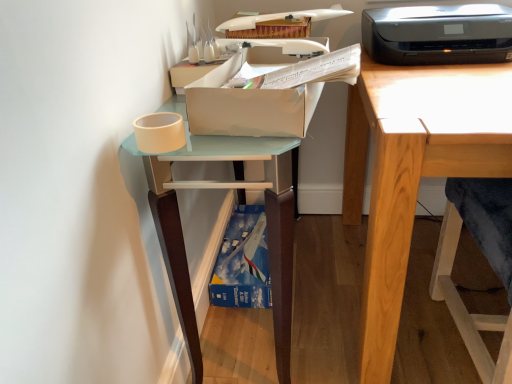
Find the location of a particular element. This screenshot has height=384, width=512. cardboard box at upper center is located at coordinates (254, 95).

What is the approximate width of matte white shelf at left?

matte white shelf at left is 35.12 centimeters wide.

The image size is (512, 384). I want to click on wooden folding chair at right, so click(487, 259).

I want to click on cardboard box at upper center, so click(254, 95).

From a real-world perspective, does black plastic printer at upper right sit lower than cardboard box at upper center?

Actually, black plastic printer at upper right is physically above cardboard box at upper center in the real world.

Is black plastic printer at upper right further to the viewer compared to cardboard box at upper center?

That is True.

Which is nearer, (504, 60) or (231, 90)?

The point (231, 90) is more forward.

Is matte white shelf at left facing towards cardboard box at upper center?

No, matte white shelf at left is not oriented towards cardboard box at upper center.

Looking at this image, is matte white shelf at left far from cardboard box at upper center?

matte white shelf at left is near cardboard box at upper center, not far away.

Which is more to the left, matte white shelf at left or cardboard box at upper center?

Positioned to the left is matte white shelf at left.

Is point (292, 237) positioned before point (311, 110)?

No, (292, 237) is behind (311, 110).

Is wooden folding chair at right beside black plastic printer at upper right?

wooden folding chair at right and black plastic printer at upper right are not in contact.

What's the angular difference between wooden folding chair at right and black plastic printer at upper right's facing directions?

There is a 179-degree angle between the facing directions of wooden folding chair at right and black plastic printer at upper right.

Considering the relative positions of wooden folding chair at right and black plastic printer at upper right in the image provided, is wooden folding chair at right to the right of black plastic printer at upper right from the viewer's perspective?

Yes, wooden folding chair at right is to the right of black plastic printer at upper right.

From a real-world perspective, which is physically below, wooden folding chair at right or black plastic printer at upper right?

wooden folding chair at right, from a real-world perspective.

From the image's perspective, which is above, cardboard box at upper center or wooden desk at right?

cardboard box at upper center, from the image's perspective.

Can we say cardboard box at upper center lies outside wooden desk at right?

That's correct, cardboard box at upper center is outside of wooden desk at right.

Looking at the image, does cardboard box at upper center seem bigger or smaller compared to wooden desk at right?

In the image, cardboard box at upper center appears to be smaller than wooden desk at right.

Can you confirm if cardboard box at upper center is positioned to the left of wooden desk at right?

Yes.

Which object is thinner, wooden folding chair at right or matte white shelf at left?

matte white shelf at left.

Is wooden folding chair at right closer to the viewer compared to matte white shelf at left?

Yes, wooden folding chair at right is closer to the camera.

Where is `printer that is behind the wooden desk at right`? printer that is behind the wooden desk at right is located at coordinates (438, 34).

Considering the sizes of objects black plastic printer at upper right and wooden desk at right in the image provided, who is shorter, black plastic printer at upper right or wooden desk at right?

Standing shorter between the two is black plastic printer at upper right.

Considering the sizes of objects black plastic printer at upper right and wooden desk at right in the image provided, who is smaller, black plastic printer at upper right or wooden desk at right?

black plastic printer at upper right is smaller.

Between black plastic printer at upper right and wooden desk at right, which one has larger width?

Wider between the two is wooden desk at right.

Can you confirm if black plastic printer at upper right is taller than matte white shelf at left?

In fact, black plastic printer at upper right may be shorter than matte white shelf at left.

Based on the photo, considering the relative positions of black plastic printer at upper right and matte white shelf at left in the image provided, is black plastic printer at upper right to the right of matte white shelf at left from the viewer's perspective?

Correct, you'll find black plastic printer at upper right to the right of matte white shelf at left.

Is black plastic printer at upper right far from matte white shelf at left?

Actually, black plastic printer at upper right and matte white shelf at left are a little close together.

From a real-world perspective, who is located lower, black plastic printer at upper right or matte white shelf at left?

matte white shelf at left is physically lower.

This screenshot has width=512, height=384. I want to click on printer to the right of cardboard box at upper center, so click(438, 34).

Find the location of `table that is below the cardboard box at upper center (from the image's perspective)`. table that is below the cardboard box at upper center (from the image's perspective) is located at coordinates (240, 203).

From the image, which object appears to be farther from wooden desk at right, wooden folding chair at right or matte white shelf at left?

The object further to wooden desk at right is matte white shelf at left.

Looking at the image, which one is located further to matte white shelf at left, wooden desk at right or black plastic printer at upper right?

Based on the image, black plastic printer at upper right appears to be further to matte white shelf at left.

Based on their spatial positions, is wooden folding chair at right or wooden desk at right further from cardboard box at upper center?

Among the two, wooden folding chair at right is located further to cardboard box at upper center.

Which object lies further to the anchor point wooden folding chair at right, matte white shelf at left or cardboard box at upper center?

cardboard box at upper center is positioned further to the anchor wooden folding chair at right.

Estimate the real-world distances between objects in this image. Which object is further from matte white shelf at left, cardboard box at upper center or wooden desk at right?

wooden desk at right is further to matte white shelf at left.

Considering their positions, is black plastic printer at upper right positioned further to cardboard box at upper center than wooden desk at right?

The object further to cardboard box at upper center is black plastic printer at upper right.

Which object lies nearer to the anchor point wooden folding chair at right, black plastic printer at upper right or cardboard box at upper center?

The object closer to wooden folding chair at right is black plastic printer at upper right.

From the image, which object appears to be nearer to cardboard box at upper center, wooden desk at right or black plastic printer at upper right?

wooden desk at right.

You are a GUI agent. You are given a task and a screenshot of the screen. Output one action in this format:
    pyautogui.click(x=<x>, y=<y>)
    Task: Click on the printer located between cardboard box at upper center and wooden desk at right in the left-right direction
    This screenshot has height=384, width=512.
    Given the screenshot: What is the action you would take?
    pyautogui.click(x=438, y=34)

Where is `cardboard box between matte white shelf at left and wooden desk at right`? The image size is (512, 384). cardboard box between matte white shelf at left and wooden desk at right is located at coordinates (254, 95).

I want to click on desk between cardboard box at upper center and wooden folding chair at right from left to right, so click(415, 169).

Image resolution: width=512 pixels, height=384 pixels. In order to click on cardboard box located between matte white shelf at left and wooden folding chair at right in the left-right direction in this screenshot , I will do 254,95.